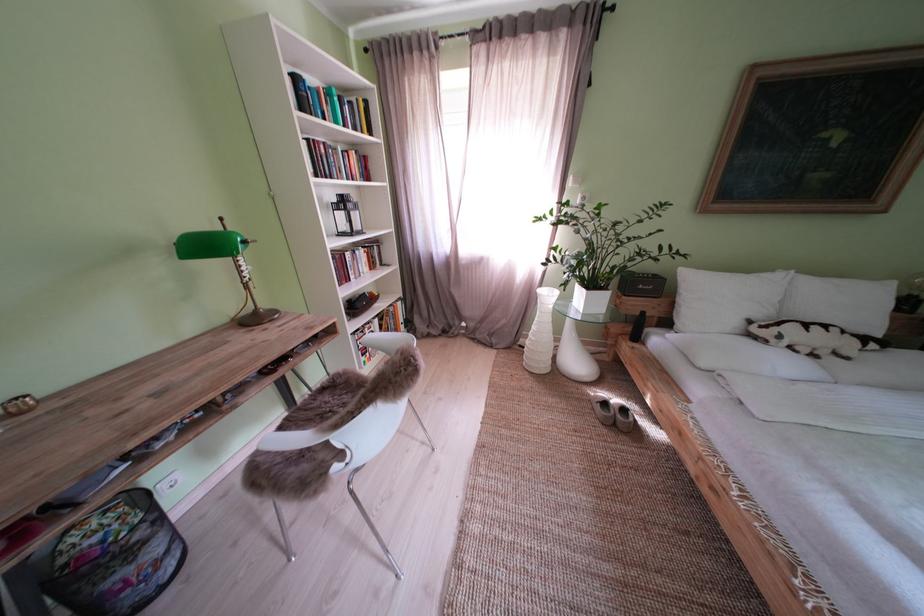
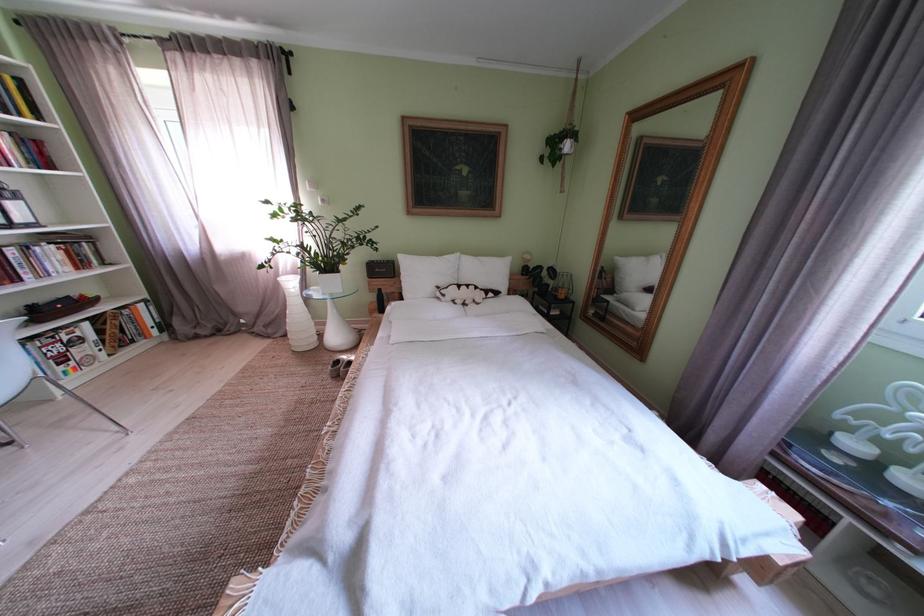
Where in the second image is the point corresponding to (616,408) from the first image?

(348, 367)